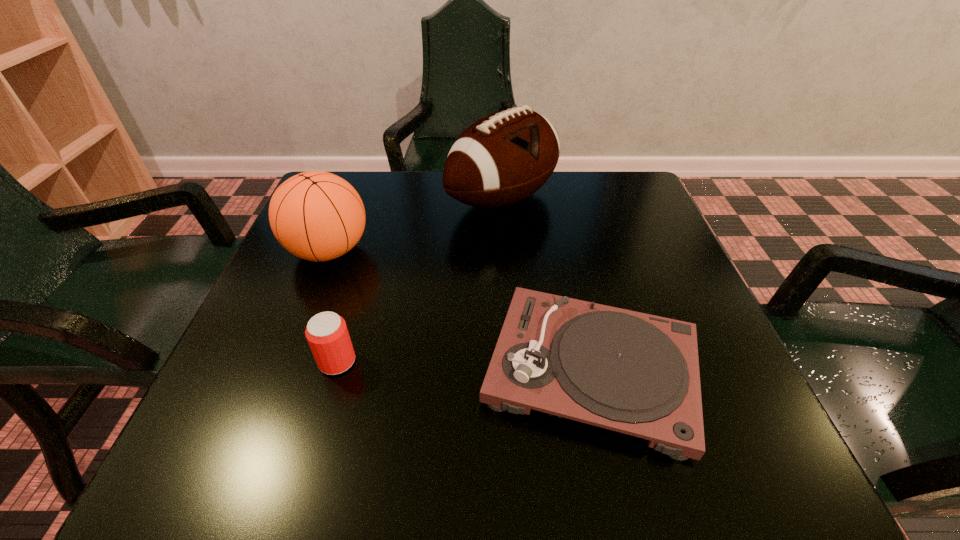
Locate an element on the screen. the tallest object is located at coordinates (505, 157).

This screenshot has width=960, height=540. In order to click on basketball in this screenshot , I will do `click(318, 216)`.

Where is `the second shortest object`? This screenshot has width=960, height=540. the second shortest object is located at coordinates (327, 334).

Locate an element on the screen. phonograph_record is located at coordinates (630, 372).

Locate an element on the screen. The image size is (960, 540). free location located 0.250m on the left of the football (American) is located at coordinates (346, 199).

You are a GUI agent. You are given a task and a screenshot of the screen. Output one action in this format:
    pyautogui.click(x=<x>, y=<y>)
    Task: Click on the vacant region located on the back of the second tallest object
    The image size is (960, 540).
    Given the screenshot: What is the action you would take?
    pyautogui.click(x=359, y=173)

In order to click on free space located 0.350m on the right of the third tallest object in this screenshot , I will do `click(567, 361)`.

Find the location of a particular element. This screenshot has width=960, height=540. vacant space located on the left of the phonograph_record is located at coordinates (258, 369).

Where is `football (American) that is at the far edge`? This screenshot has height=540, width=960. football (American) that is at the far edge is located at coordinates (505, 157).

Find the location of a particular element. The height and width of the screenshot is (540, 960). basketball at the far edge is located at coordinates (318, 216).